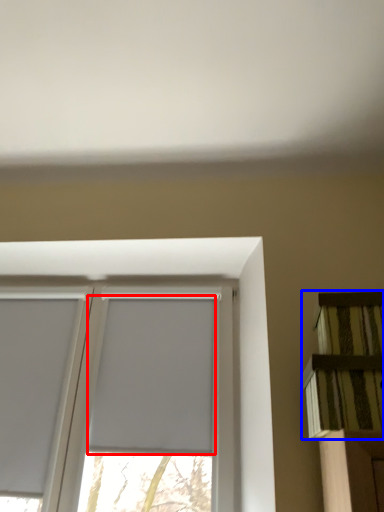
Question: Which of the following is the closest to the observer, window screen (highlighted by a red box) or shelf (highlighted by a blue box)?

Choices:
 (A) window screen
 (B) shelf

Answer: (B)